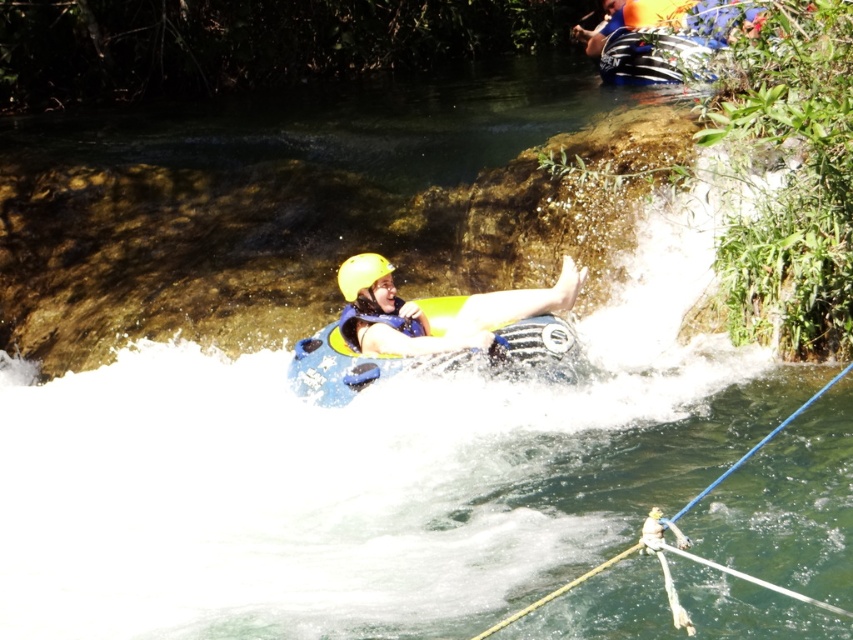
You are standing at the camera position and want to throw a rope to the person in the blue rubber boat at center. The rope you have is 8 meters long. Will you be able to reach them?

The blue rubber boat at center and camera are 8.62 meters apart. Since the rope is only 8 meters long, it is 0.62 meters shorter than the distance required. Therefore, you will not be able to reach the person in the blue rubber boat at center with the rope you have.

You are a river guide observing the scene. You notice a point at coordinates (759, 444). Which object is this point located on?

The point at coordinates (759, 444) is on the blue rubber paddle at lower center.